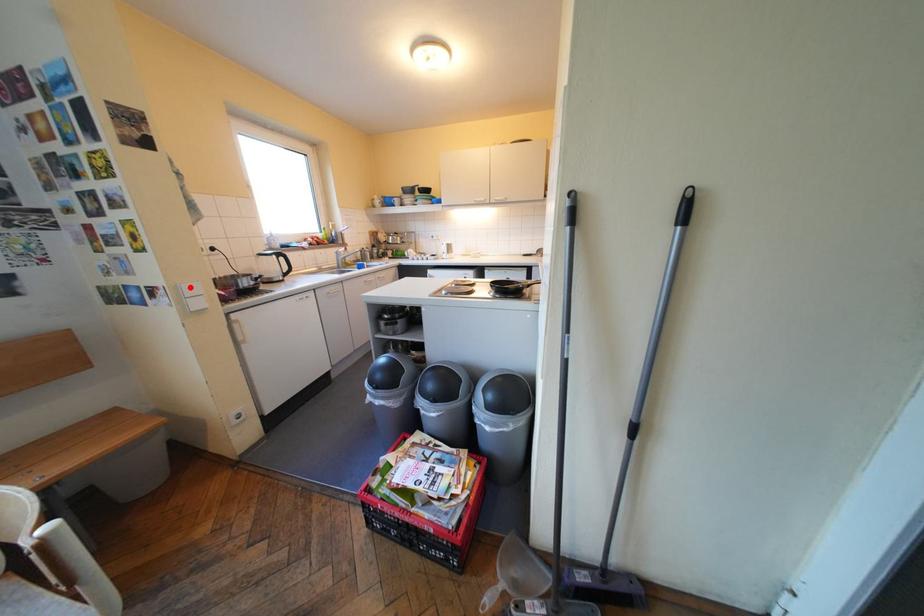
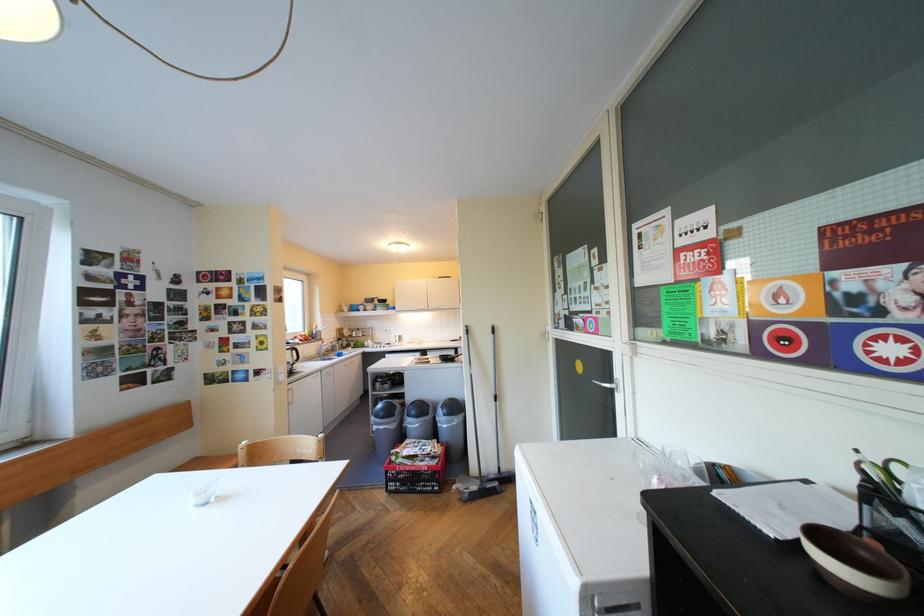
Where in the second image is the point corresponding to the highlighted location from the first image?

(288, 368)